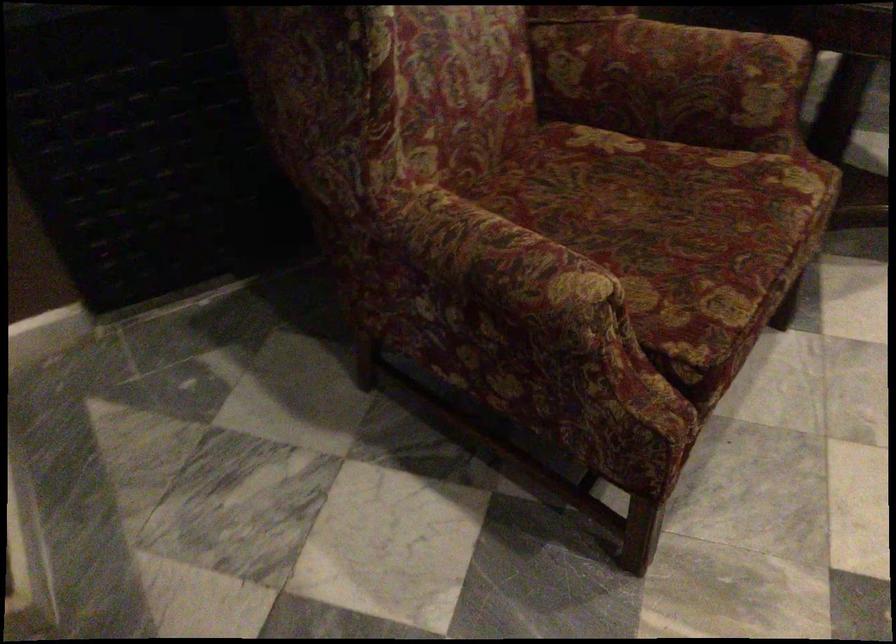
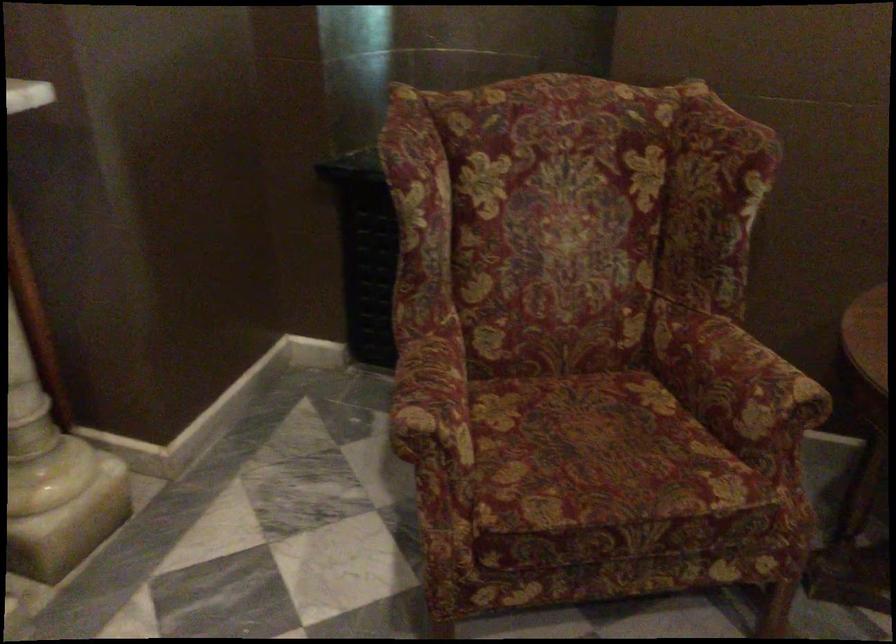
Question: The first image is from the beginning of the video and the second image is from the end. How did the camera likely rotate when shooting the video?

Choices:
 (A) Left
 (B) Right
 (C) Up
 (D) Down

Answer: (A)